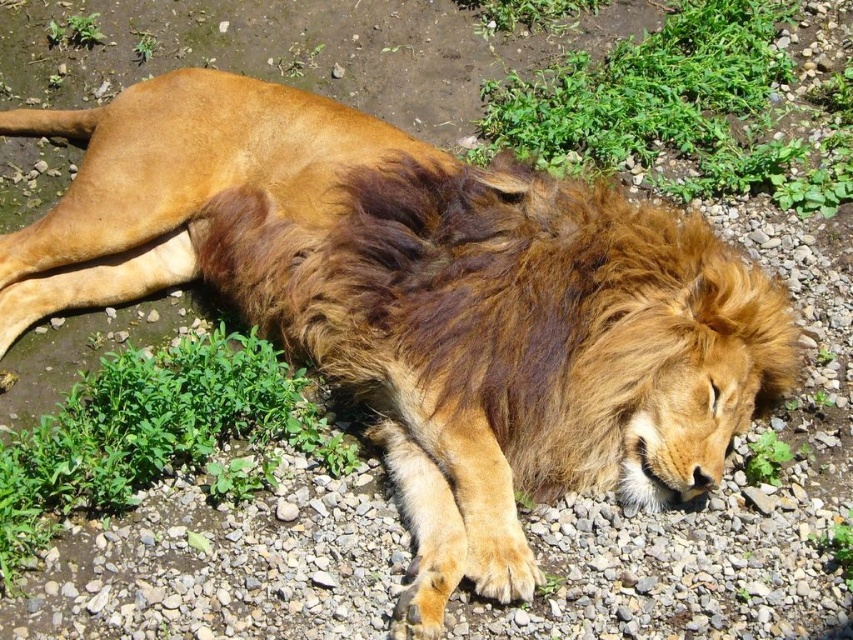
Question: Is green leafy grass at upper center to the left of green leafy grass at lower left from the viewer's perspective?

Choices:
 (A) yes
 (B) no

Answer: (B)

Question: Which of the following is the farthest from the observer?

Choices:
 (A) green leafy grass at upper center
 (B) green leafy grass at lower left

Answer: (A)

Question: Among these points, which one is nearest to the camera?

Choices:
 (A) (822, 83)
 (B) (173, 474)

Answer: (B)

Question: Does green leafy grass at upper center lie behind green leafy grass at lower left?

Choices:
 (A) yes
 (B) no

Answer: (A)

Question: Does green leafy grass at upper center appear under green leafy grass at lower left?

Choices:
 (A) yes
 (B) no

Answer: (B)

Question: Which of the following is the closest to the observer?

Choices:
 (A) (242, 348)
 (B) (728, 54)

Answer: (A)